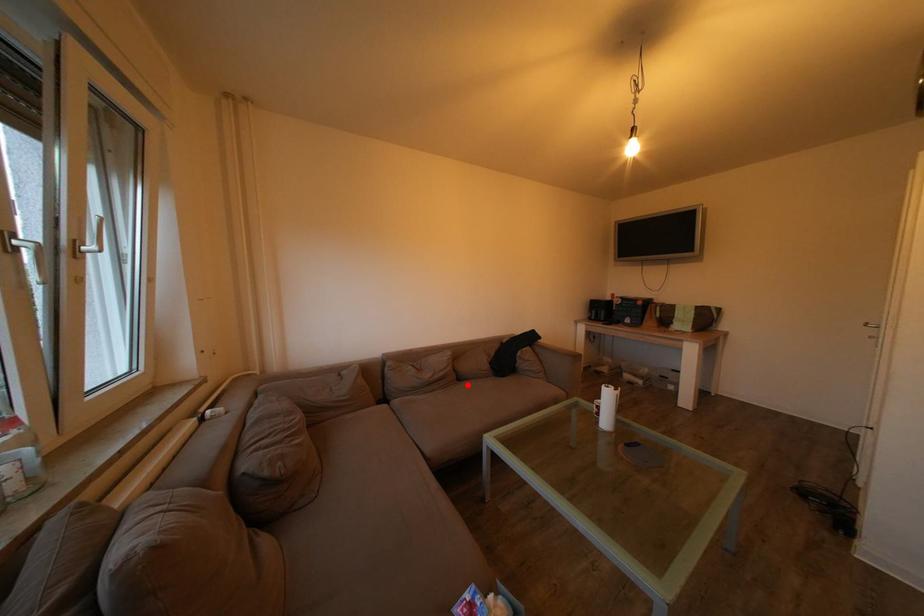
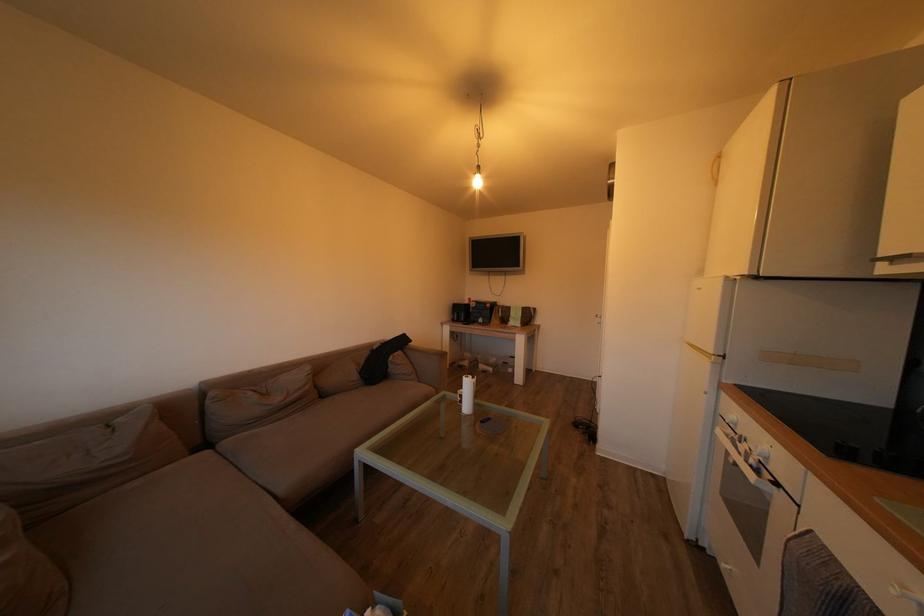
In the second image, find the point that corresponds to the highlighted location in the first image.

(331, 402)